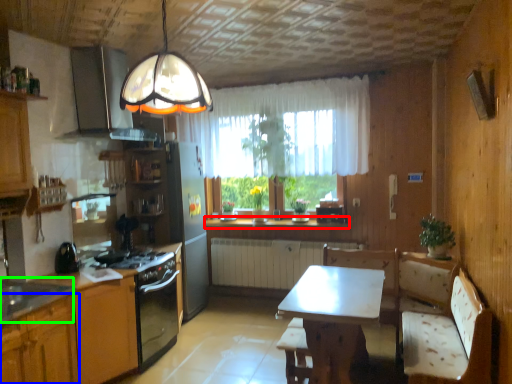
Question: Considering the real-world distances, which object is closest to countertop (highlighted by a red box)? cabinetry (highlighted by a blue box) or sink (highlighted by a green box).

Choices:
 (A) cabinetry
 (B) sink

Answer: (B)